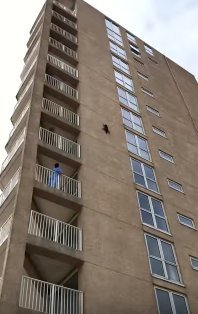
Image resolution: width=198 pixels, height=314 pixels. I want to click on lines separating floors, so click(118, 273).